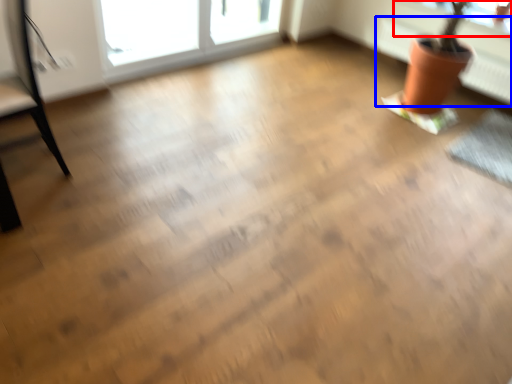
Question: Which object is further to the camera taking this photo, window screen (highlighted by a red box) or radiator (highlighted by a blue box)?

Choices:
 (A) window screen
 (B) radiator

Answer: (A)